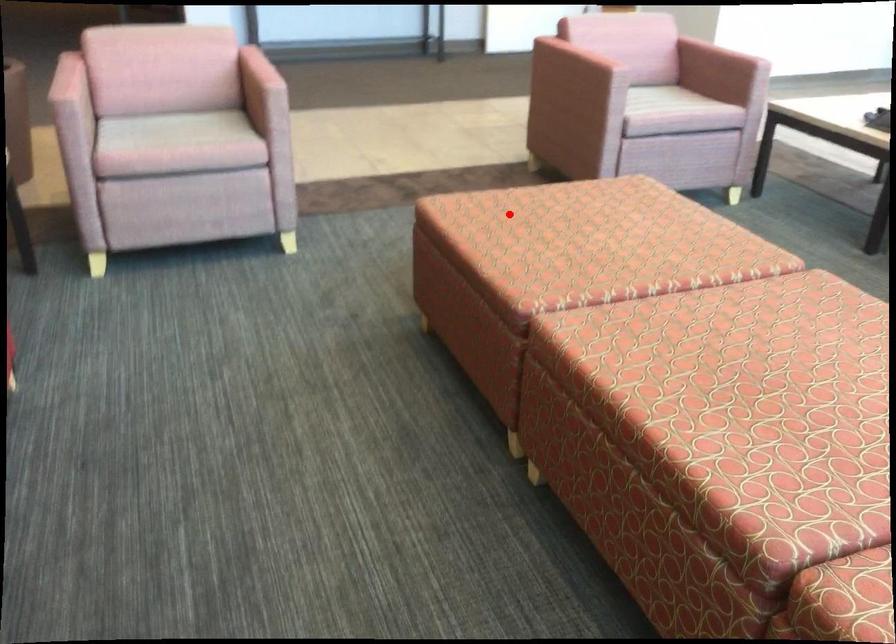
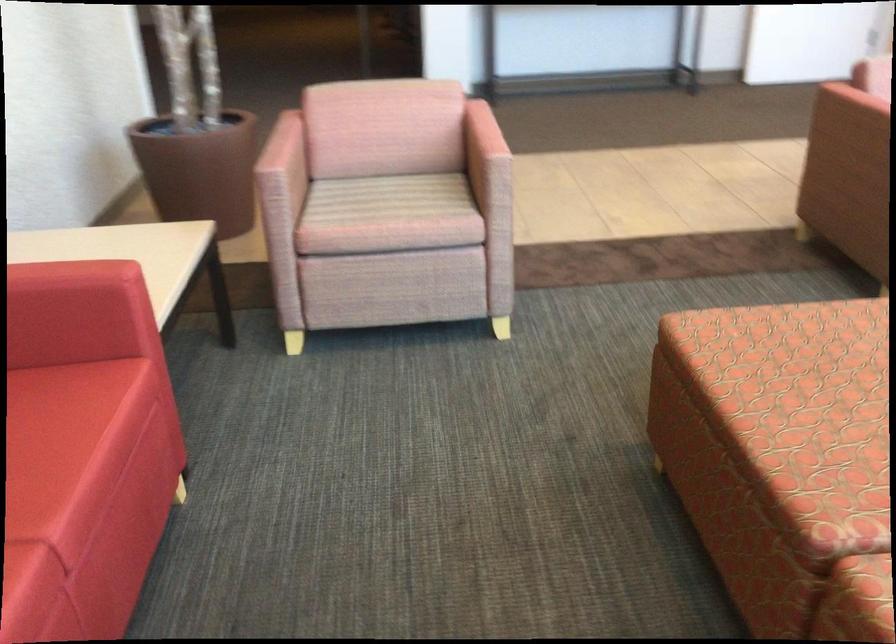
Where in the second image is the point corresponding to the highlighted location from the first image?

(782, 350)